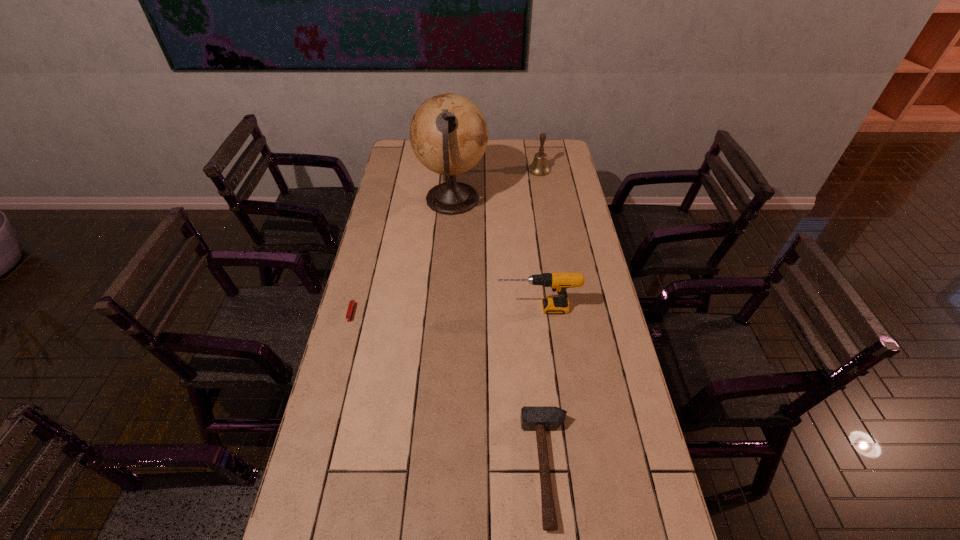
Locate an element on the screen. vacant region between the leftmost object and the third shortest object is located at coordinates tap(444, 310).

Where is `empty space between the fourth shortest object and the tallest object`? empty space between the fourth shortest object and the tallest object is located at coordinates (495, 185).

Identify the location of free space between the third tallest object and the nearest object. (542, 388).

The image size is (960, 540). I want to click on free spot between the fourth shortest object and the globe, so click(x=495, y=185).

Image resolution: width=960 pixels, height=540 pixels. I want to click on unoccupied position between the drill and the globe, so click(x=494, y=254).

Image resolution: width=960 pixels, height=540 pixels. I want to click on free space between the tallest object and the bell, so click(495, 185).

This screenshot has width=960, height=540. What are the coordinates of `vacant region between the third tallest object and the second shortest object` in the screenshot? It's located at (542, 388).

You are a GUI agent. You are given a task and a screenshot of the screen. Output one action in this format:
    pyautogui.click(x=<x>, y=<y>)
    Task: Click on the vacant space that's between the drill and the second tallest object
    The height and width of the screenshot is (540, 960).
    Given the screenshot: What is the action you would take?
    pyautogui.click(x=538, y=239)

I want to click on object that is the second nearest to the tallest object, so click(x=559, y=282).

Locate which object ranks fourth in proximity to the drill. Please provide its 2D coordinates. Your answer should be formatted as a tuple, i.e. [(x, y)], where the tuple contains the x and y coordinates of a point satisfying the conditions above.

[(539, 167)]